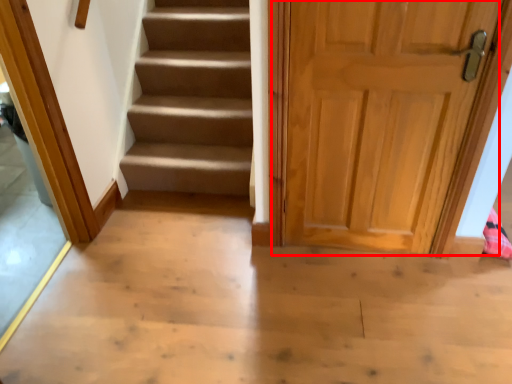
Question: From the image, what is the correct spatial relationship of door (annotated by the red box) in relation to glass door?

Choices:
 (A) left
 (B) right

Answer: (B)